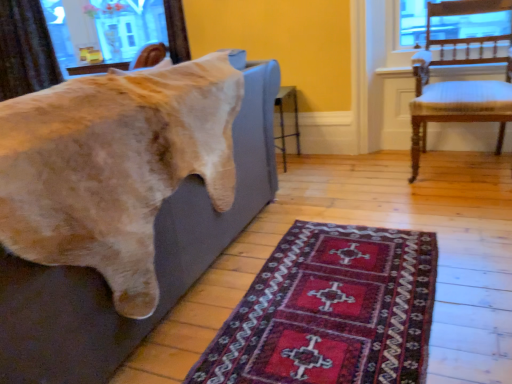
Question: Can you confirm if soft gray couch at left is wider than brown textured curtain at upper left?

Choices:
 (A) yes
 (B) no

Answer: (A)

Question: Does soft gray couch at left have a greater height compared to brown textured curtain at upper left?

Choices:
 (A) yes
 (B) no

Answer: (B)

Question: Can you confirm if soft gray couch at left is smaller than brown textured curtain at upper left?

Choices:
 (A) yes
 (B) no

Answer: (B)

Question: Is brown textured curtain at upper left completely or partially inside soft gray couch at left?

Choices:
 (A) yes
 (B) no

Answer: (B)

Question: Is soft gray couch at left bigger than brown textured curtain at upper left?

Choices:
 (A) yes
 (B) no

Answer: (A)

Question: From the image's perspective, is brown textured curtain at upper left above or below wooden chair with white cushioning at right?

Choices:
 (A) above
 (B) below

Answer: (A)

Question: In the image, is brown textured curtain at upper left positioned in front of or behind wooden chair with white cushioning at right?

Choices:
 (A) behind
 (B) front

Answer: (A)

Question: Is point (35, 67) closer or farther from the camera than point (501, 41)?

Choices:
 (A) closer
 (B) farther

Answer: (B)

Question: Is brown textured curtain at upper left inside or outside of wooden chair with white cushioning at right?

Choices:
 (A) inside
 (B) outside

Answer: (B)

Question: Is point [x=238, y=144] positioned closer to the camera than point [x=465, y=119]?

Choices:
 (A) closer
 (B) farther

Answer: (A)

Question: From the image's perspective, is soft gray couch at left located above or below wooden chair with white cushioning at right?

Choices:
 (A) above
 (B) below

Answer: (B)

Question: Is soft gray couch at left in front of or behind wooden chair with white cushioning at right in the image?

Choices:
 (A) behind
 (B) front

Answer: (B)

Question: Considering the positions of soft gray couch at left and wooden chair with white cushioning at right in the image, is soft gray couch at left taller or shorter than wooden chair with white cushioning at right?

Choices:
 (A) tall
 (B) short

Answer: (B)

Question: From their relative heights in the image, would you say wooden chair with white cushioning at right is taller or shorter than brown textured curtain at upper left?

Choices:
 (A) tall
 (B) short

Answer: (B)

Question: From the image's perspective, is wooden chair with white cushioning at right located above or below brown textured curtain at upper left?

Choices:
 (A) below
 (B) above

Answer: (A)